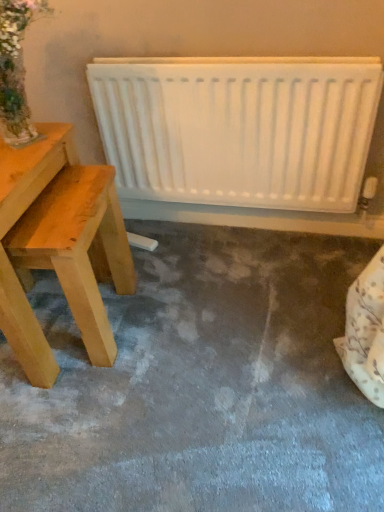
Question: Is white matte radiator at upper center inside or outside of light wood table at left?

Choices:
 (A) inside
 (B) outside

Answer: (B)

Question: Considering the relative positions of white matte radiator at upper center and light wood table at left in the image provided, is white matte radiator at upper center to the left or to the right of light wood table at left?

Choices:
 (A) right
 (B) left

Answer: (A)

Question: Based on their sizes in the image, would you say white matte radiator at upper center is bigger or smaller than light wood table at left?

Choices:
 (A) small
 (B) big

Answer: (A)

Question: From the image's perspective, is light wood table at left above or below white matte radiator at upper center?

Choices:
 (A) below
 (B) above

Answer: (A)

Question: Is point (109, 361) positioned closer to the camera than point (350, 200)?

Choices:
 (A) closer
 (B) farther

Answer: (A)

Question: In the image, is light wood table at left positioned in front of or behind white matte radiator at upper center?

Choices:
 (A) behind
 (B) front

Answer: (B)

Question: From a real-world perspective, relative to white matte radiator at upper center, is light wood table at left vertically above or below?

Choices:
 (A) below
 (B) above

Answer: (A)